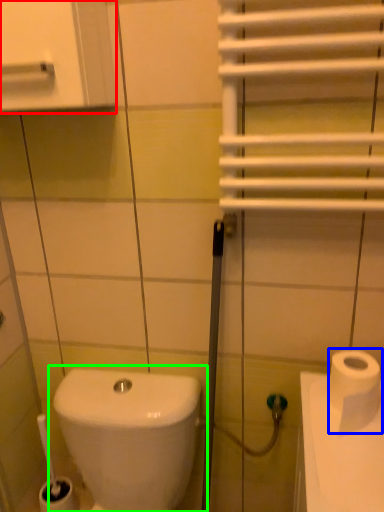
Question: Considering the real-world distances, which object is closest to medicine cabinet (highlighted by a red box)? toilet paper (highlighted by a blue box) or toilet (highlighted by a green box).

Choices:
 (A) toilet paper
 (B) toilet

Answer: (A)